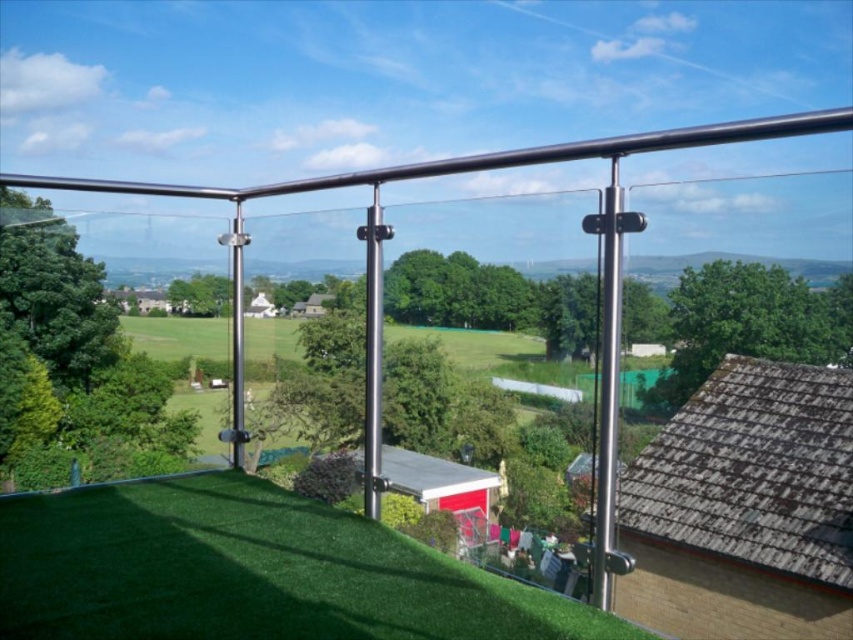
You are standing on the balcony and want to place a large potted plant on the green artificial turf at lower center. Can you also place a small decorative statue on the satin silver pole at center without moving the potted plant? Explain why based on their sizes.

The green artificial turf at lower center is bigger than the satin silver pole at center. Since the potted plant requires more space, placing it on the larger surface ensures stability. The small decorative statue can be placed on the satin silver pole at center as it is smaller and can accommodate the statue without needing additional space.

You are standing on the balcony and want to locate the point at coordinates (607, 381). Where exactly is this point located?

The point at coordinates (607, 381) is on the polished stainless steel pole at center.